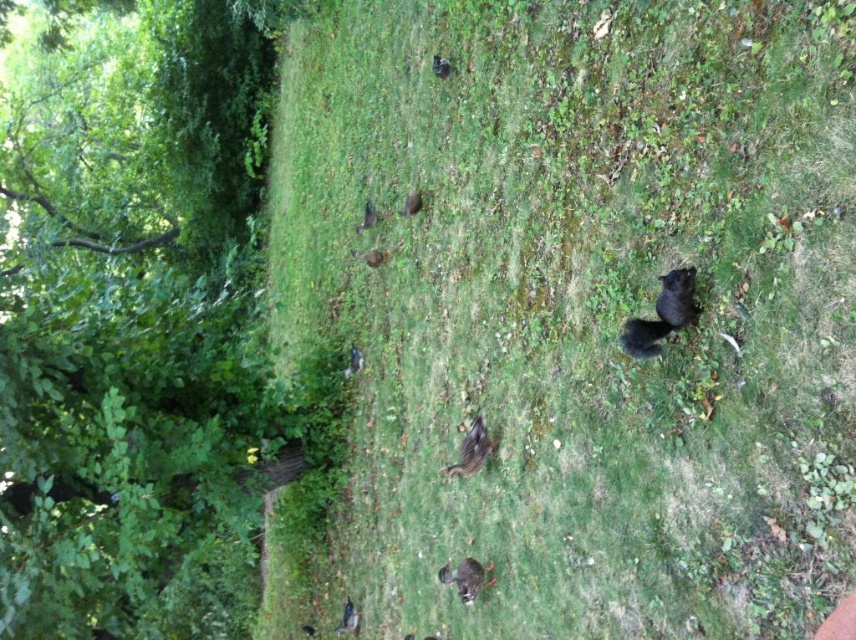
This screenshot has height=640, width=856. Describe the element at coordinates (473, 449) in the screenshot. I see `brown fuzzy bird at center` at that location.

The image size is (856, 640). In order to click on brown fuzzy bird at center in this screenshot , I will do `click(473, 449)`.

From the picture: Is green grassy at center below black furry squirrel at center?

Yes, green grassy at center is below black furry squirrel at center.

Between point (840, 68) and point (372, 204), which one is positioned in front?

Point (840, 68) is more forward.

Locate an element on the screen. green grassy at center is located at coordinates (574, 312).

Is the position of green grassy at center more distant than that of shiny black duckling at lower center?

No, it is not.

From the picture: Does green grassy at center appear under shiny black duckling at lower center?

Actually, green grassy at center is above shiny black duckling at lower center.

Locate an element on the screen. The width and height of the screenshot is (856, 640). green grassy at center is located at coordinates (574, 312).